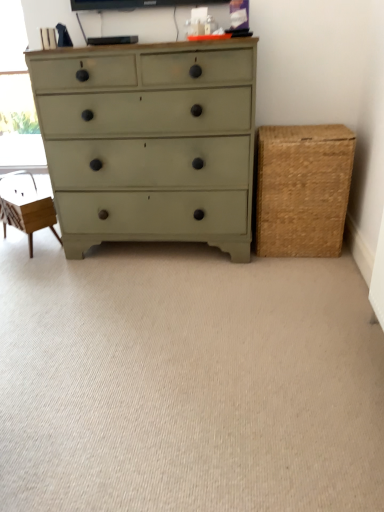
Where is `vacant area that lies in front of satin green dresser at center`? The image size is (384, 512). vacant area that lies in front of satin green dresser at center is located at coordinates (164, 308).